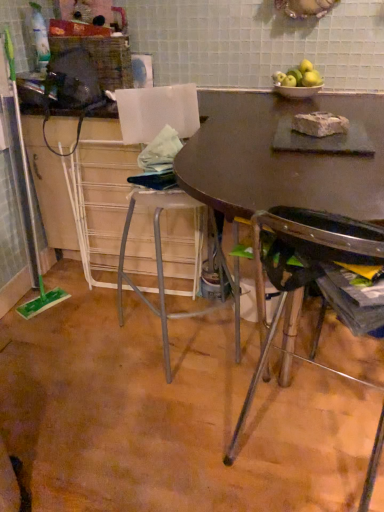
At what (x,y) coordinates should I click in order to perform the action: click on vacant space positioned to the left of matte brown table at center. Please return your answer as a coordinate pair (x, y). This screenshot has width=384, height=512. Looking at the image, I should click on (84, 384).